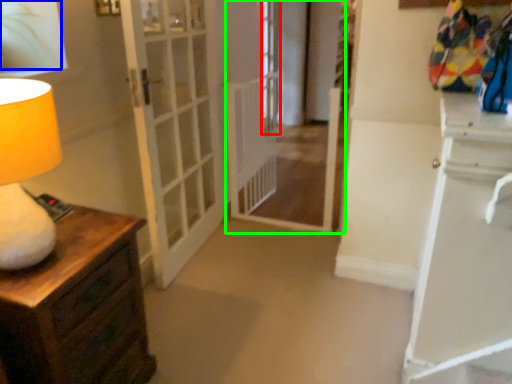
Question: Which object is the closest to the window (highlighted by a red box)? Choose among these: plant (highlighted by a blue box) or passage (highlighted by a green box).

Choices:
 (A) plant
 (B) passage

Answer: (B)